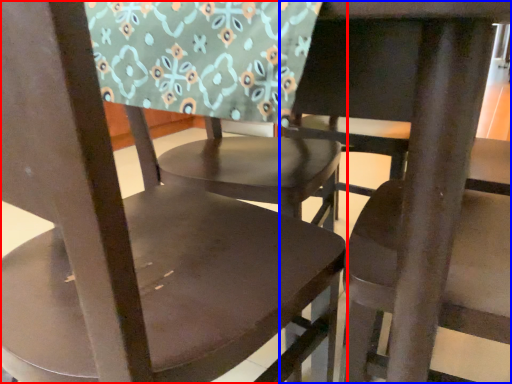
Question: Which of the following is the farthest to the observer, chair (highlighted by a red box) or chair (highlighted by a blue box)?

Choices:
 (A) chair
 (B) chair

Answer: (B)